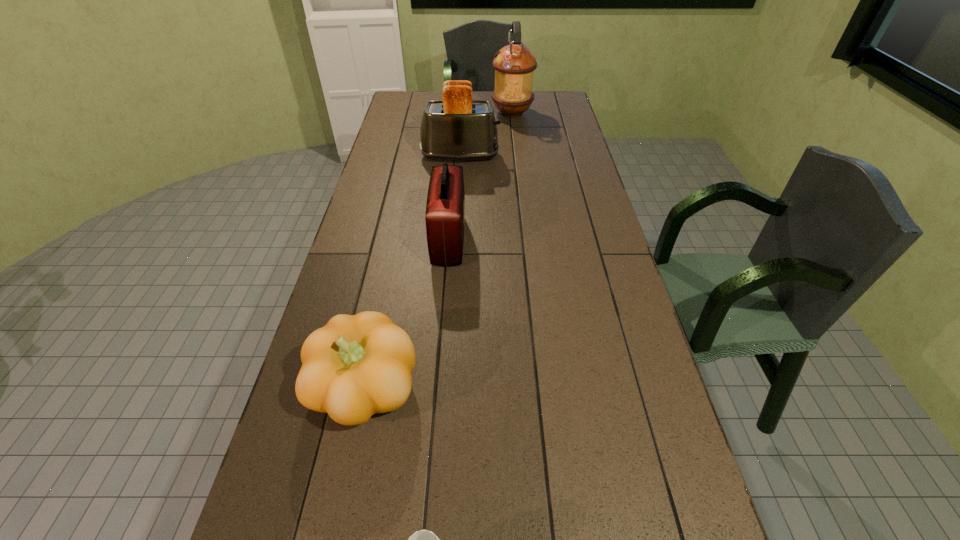
The height and width of the screenshot is (540, 960). Find the location of `vacant space located on the side of the first aid kit with the cross symbol`. vacant space located on the side of the first aid kit with the cross symbol is located at coordinates (517, 240).

The height and width of the screenshot is (540, 960). Find the location of `vacant region located 0.360m on the back of the second nearest object`. vacant region located 0.360m on the back of the second nearest object is located at coordinates 394,251.

At what (x,y) coordinates should I click in order to perform the action: click on object at the far edge. Please return your answer as a coordinate pair (x, y). Looking at the image, I should click on (514, 64).

Where is `object that is at the left edge`? object that is at the left edge is located at coordinates point(355,366).

Image resolution: width=960 pixels, height=540 pixels. Identify the location of blank space at the far edge. (440, 98).

This screenshot has height=540, width=960. In order to click on vacant space at the left edge of the desktop in this screenshot , I will do `click(408, 155)`.

Where is `free location at the right edge of the desktop`? free location at the right edge of the desktop is located at coordinates (554, 114).

At what (x,y) coordinates should I click in order to perform the action: click on vacant space that is in between the oil lamp and the first aid kit. Please return your answer as a coordinate pair (x, y). The width and height of the screenshot is (960, 540). Looking at the image, I should click on (480, 177).

What are the coordinates of `blank region between the third tallest object and the pumpkin` in the screenshot? It's located at (407, 315).

The width and height of the screenshot is (960, 540). What are the coordinates of `free space between the pumpkin and the third farthest object` in the screenshot? It's located at (407, 315).